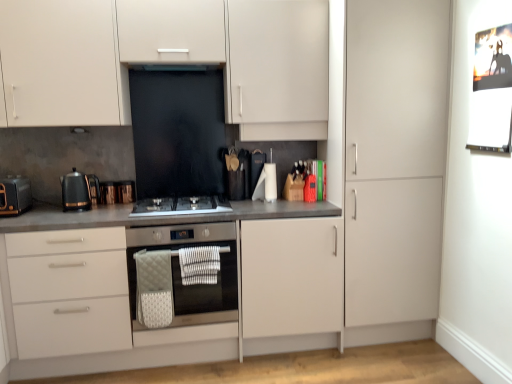
Identify the location of free spot in front of copper metallic kettle at center-left, arranged as the second appliance when viewed from the left. The width and height of the screenshot is (512, 384). (124, 200).